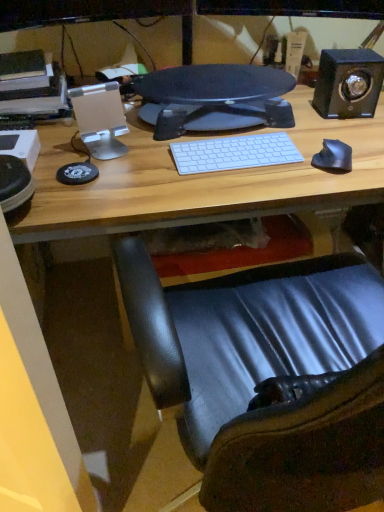
The image size is (384, 512). I want to click on free point above white matte keyboard at center (from a real-world perspective), so click(233, 147).